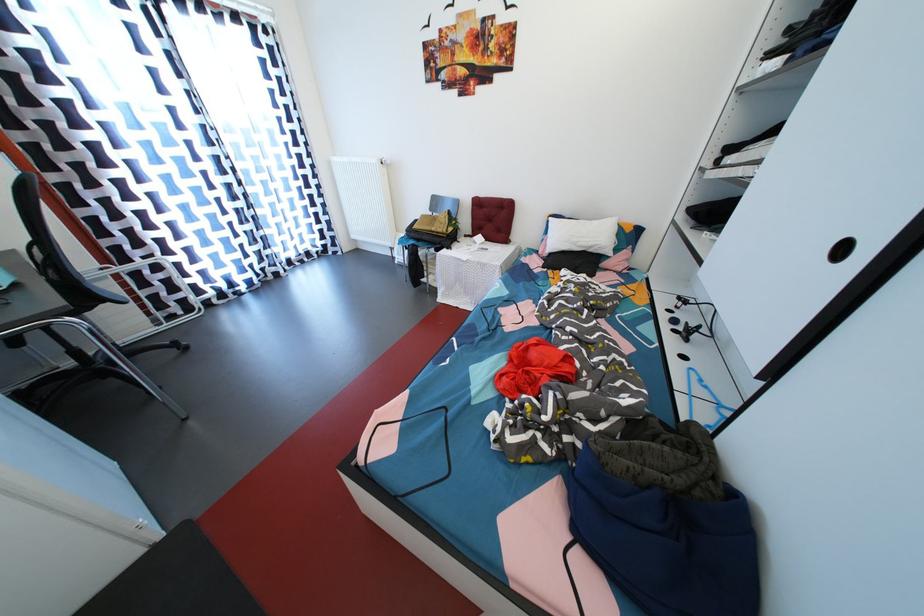
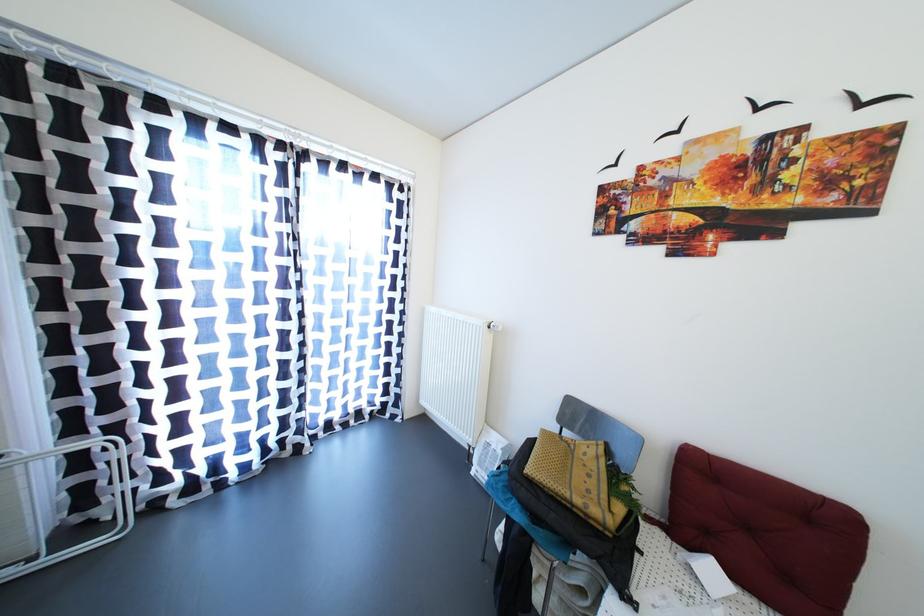
The point at (359, 241) is marked in the first image. Where is the corresponding point in the second image?

(430, 407)